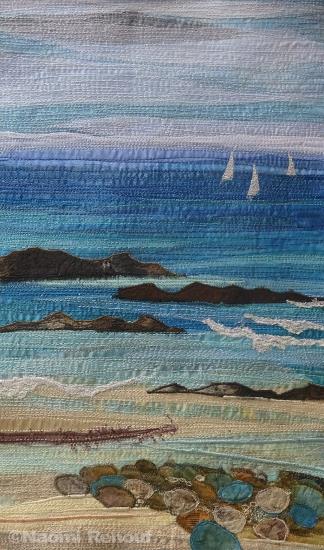
What are the coordinates of `art` in the screenshot? It's located at (241, 481).